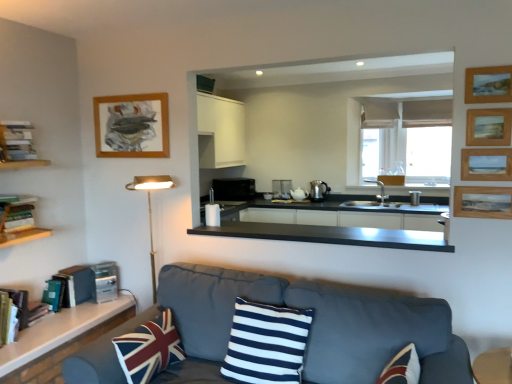
The height and width of the screenshot is (384, 512). I want to click on vacant area on top of wooden framed painting of fish at upper left, placed as the fifth picture frame when sorted from right to left (from a real-world perspective), so click(x=125, y=95).